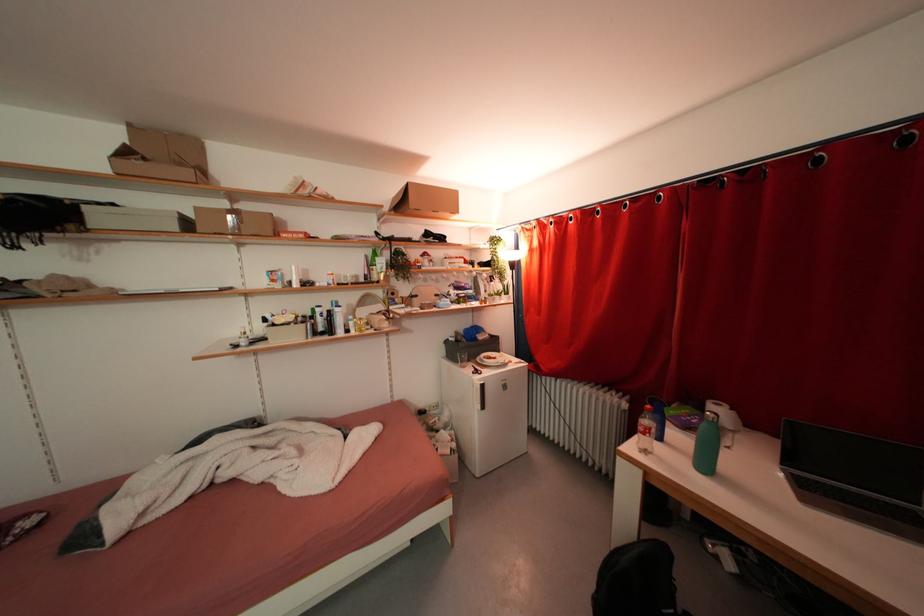
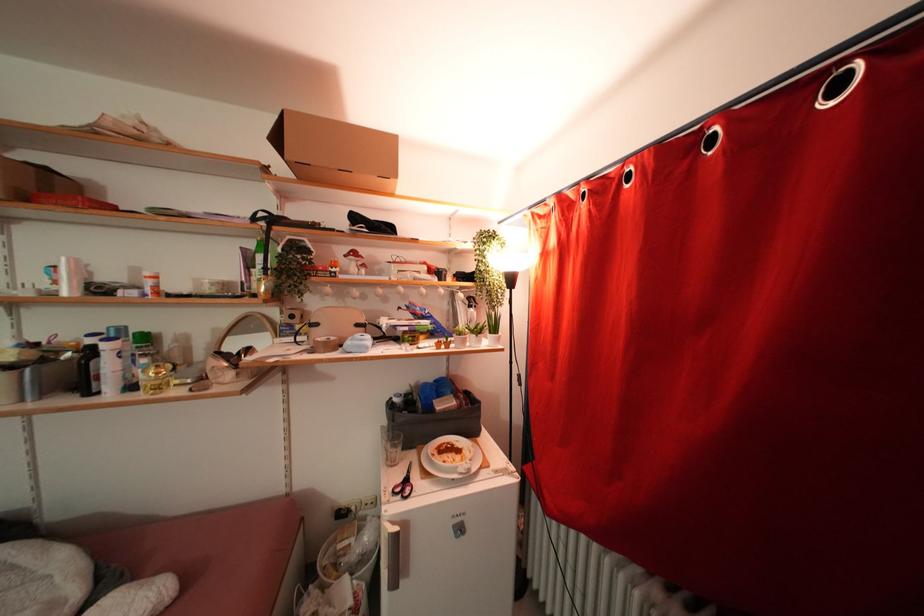
In a continuous first-person perspective shot, in which direction is the camera moving?

The cameraman walked toward right, forward.